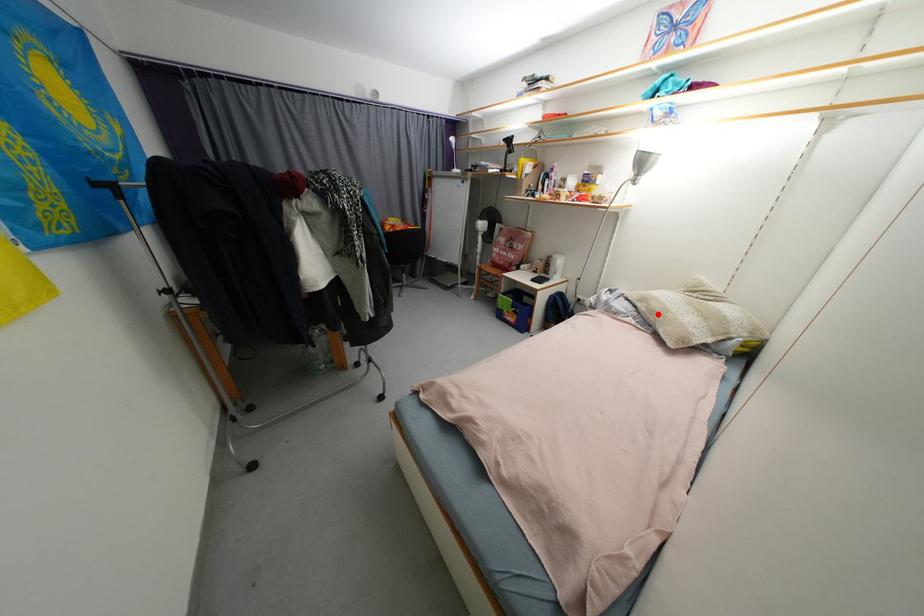
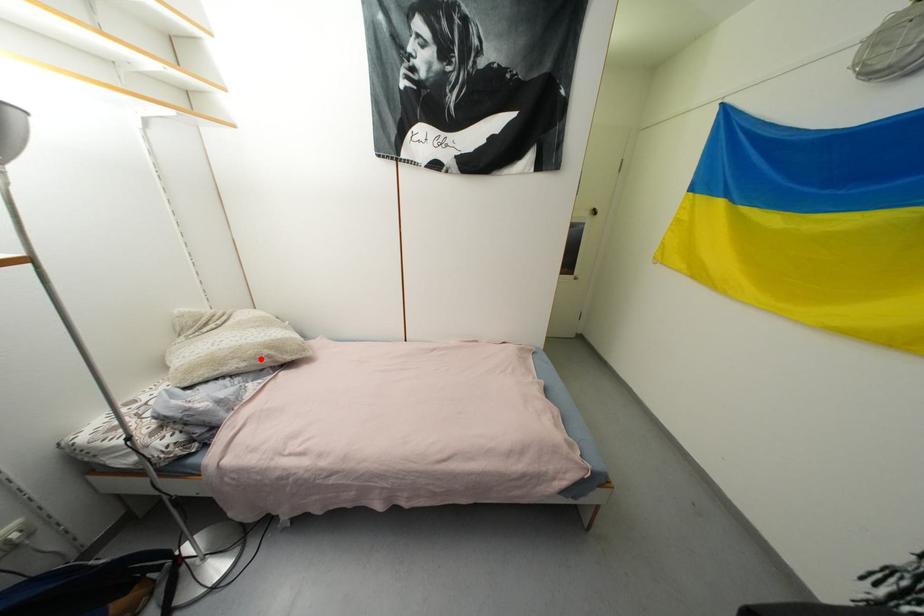
I am providing you with two images of the same scene from different viewpoints. A red point is marked on the first image and another point is marked on the second image. Are the points marked in image1 and image2 representing the same 3D position?

Yes